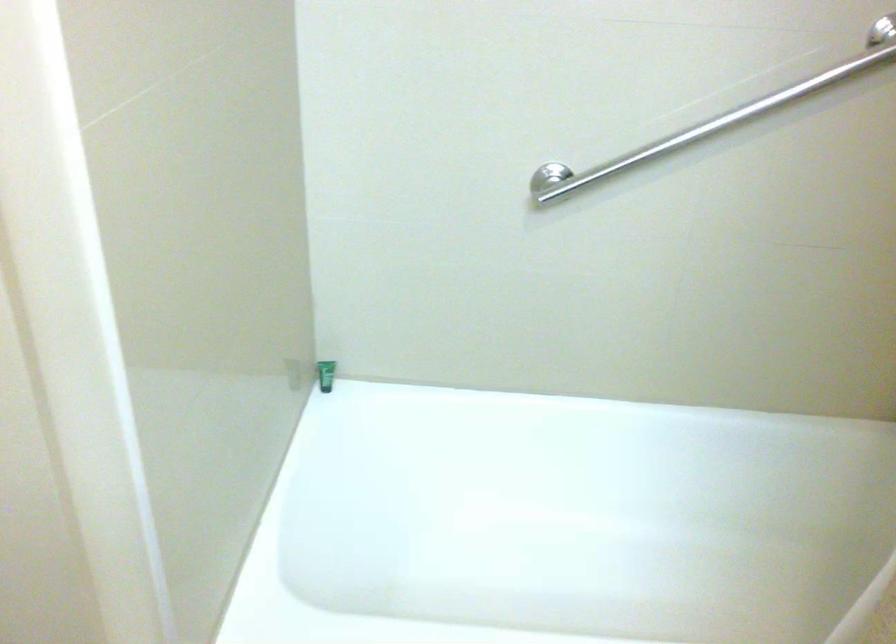
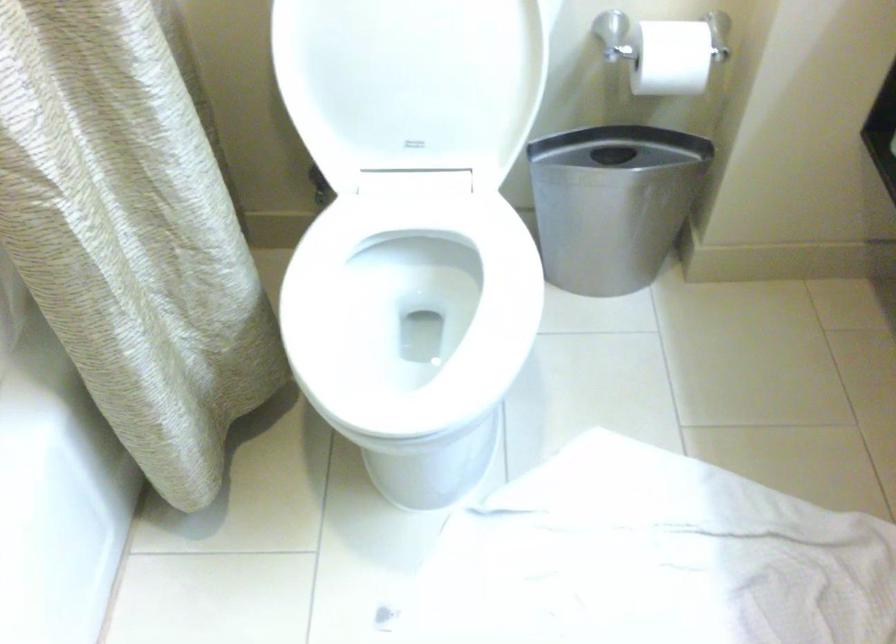
Looking at this image, the images are taken continuously from a first-person perspective. In which direction is your viewpoint rotating?

The camera's rotation is toward right-down.